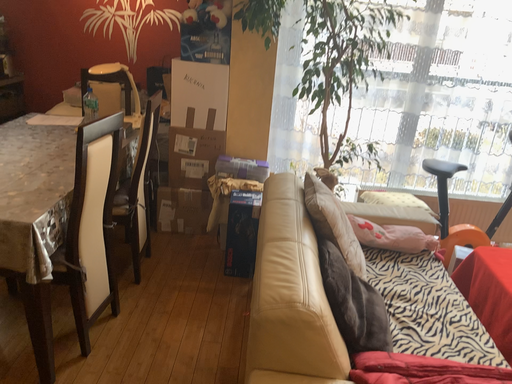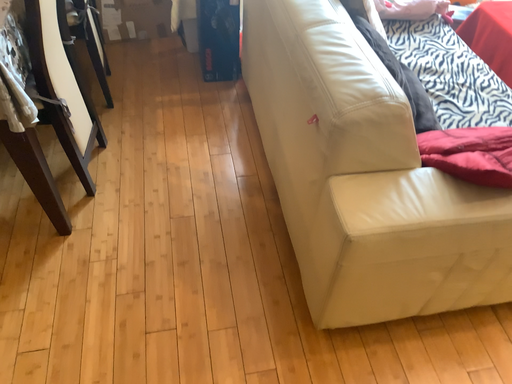
Question: How did the camera likely rotate when shooting the video?

Choices:
 (A) rotated upward
 (B) rotated downward

Answer: (B)